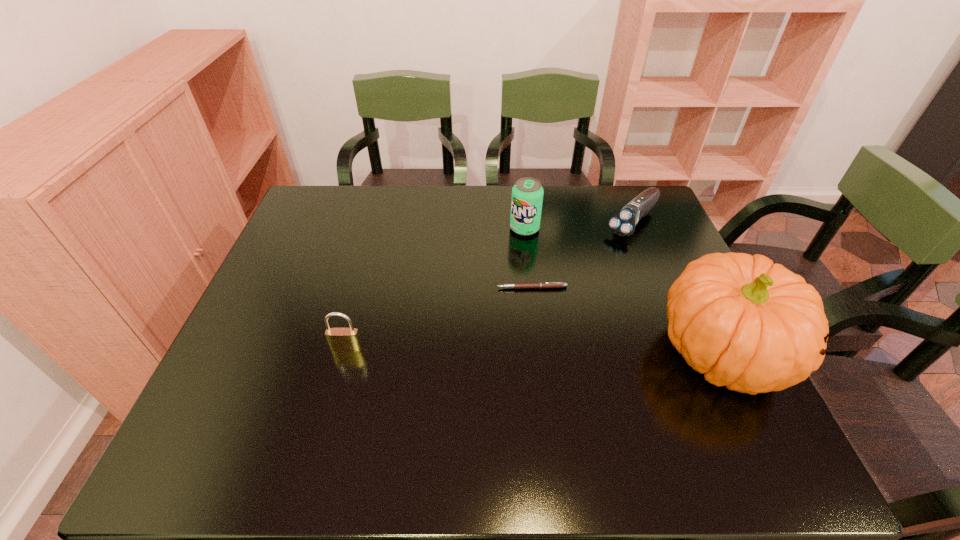
The image size is (960, 540). In order to click on free spot between the pop soda and the pen in this screenshot , I will do `click(528, 258)`.

Find the location of `the second closest object to the leftmost object`. the second closest object to the leftmost object is located at coordinates (527, 194).

This screenshot has height=540, width=960. Identify the location of object that is the second closest one to the tallest object. (623, 223).